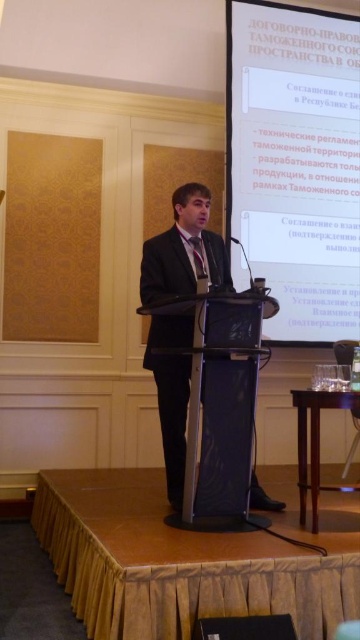
You are an attendee sitting in the front row of the conference room. You notice the white glossy projection screen at upper center and the black suit at center. Which object is closer to you?

The white glossy projection screen at upper center is closer to you because it is further to the viewer than the black suit at center.

Consider the image. You are an attendee in the conference room and want to see the presenter clearly. Which object is positioned higher in the image, the white glossy projection screen at upper center or the black suit at center?

The white glossy projection screen at upper center is located above the black suit at center, so it is positioned higher in the image.